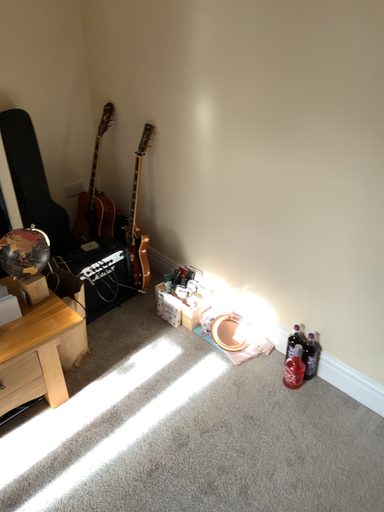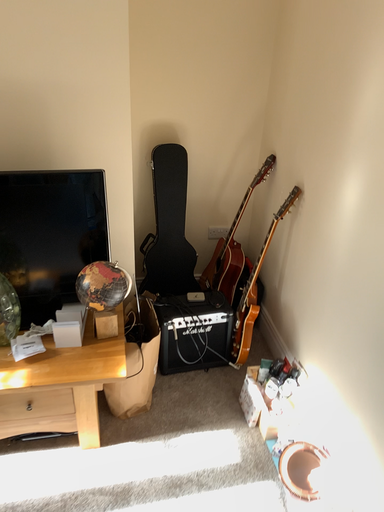
Question: How did the camera likely rotate when shooting the video?

Choices:
 (A) rotated right
 (B) rotated left

Answer: (B)